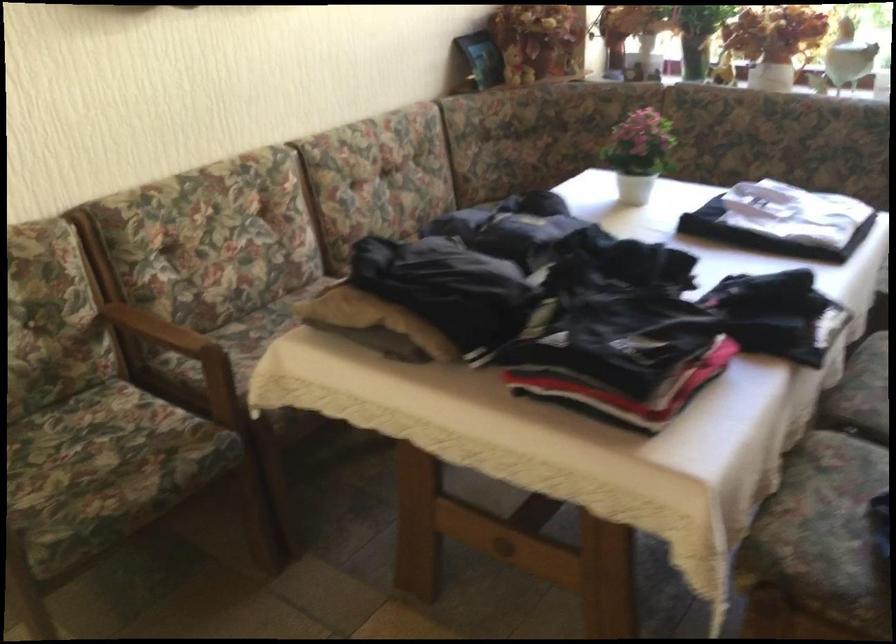
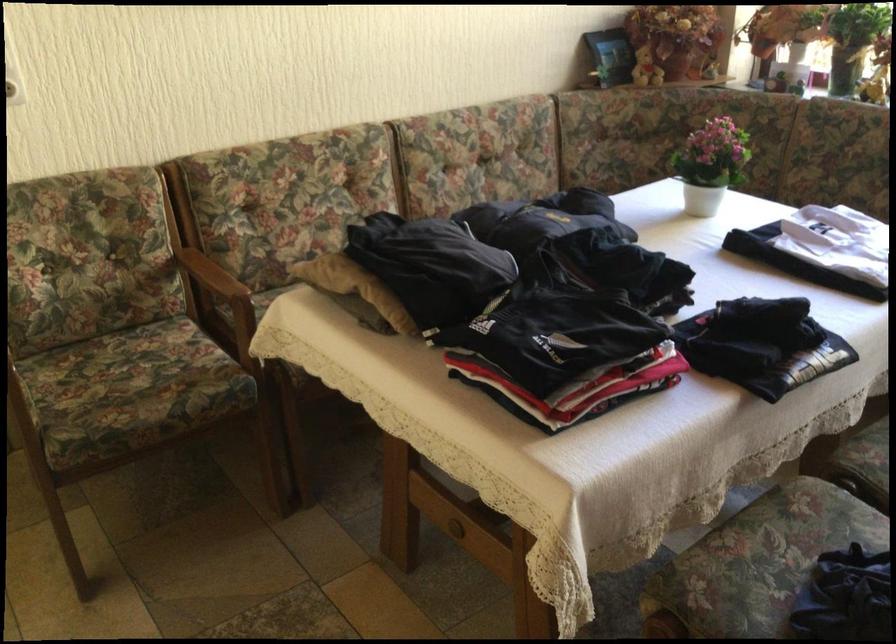
Find the pixel in the second image that matches (382,319) in the first image.

(355, 287)